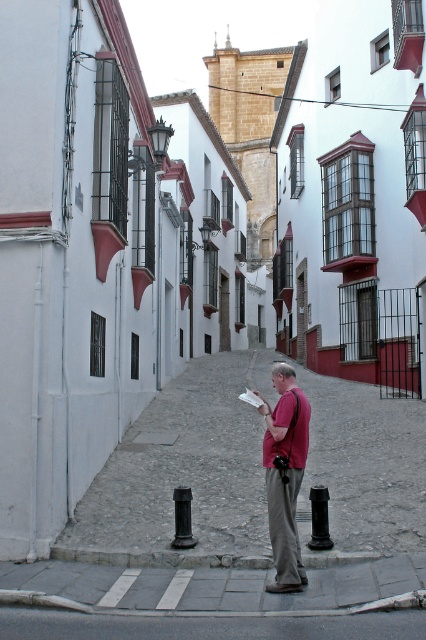
Describe the element at coordinates (186, 465) in the screenshot. I see `smooth stone alley at center` at that location.

Find the location of a particular element. smooth stone alley at center is located at coordinates (186, 465).

Is matte red shirt at center to the right of black matte pole at lower center from the viewer's perspective?

In fact, matte red shirt at center is to the left of black matte pole at lower center.

The height and width of the screenshot is (640, 426). Describe the element at coordinates (284, 474) in the screenshot. I see `matte red shirt at center` at that location.

Is point (279, 422) less distant than point (317, 528)?

Yes, it is.

I want to click on matte red shirt at center, so click(x=284, y=474).

Can you confirm if smooth stone alley at center is positioned above black matte pole at lower center?

Yes, smooth stone alley at center is above black matte pole at lower center.

Who is more forward, (344, 456) or (327, 531)?

Point (327, 531) is more forward.

The height and width of the screenshot is (640, 426). I want to click on smooth stone alley at center, so click(x=186, y=465).